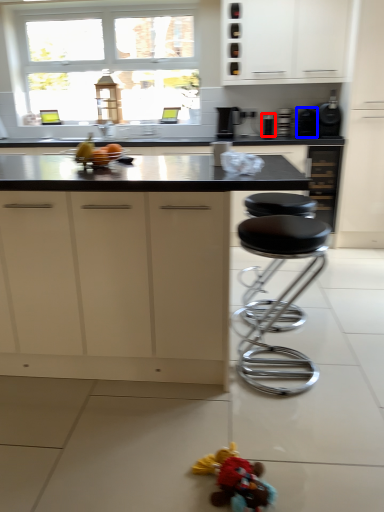
Question: Which object is closer to the camera taking this photo, appliance (highlighted by a red box) or appliance (highlighted by a blue box)?

Choices:
 (A) appliance
 (B) appliance

Answer: (B)